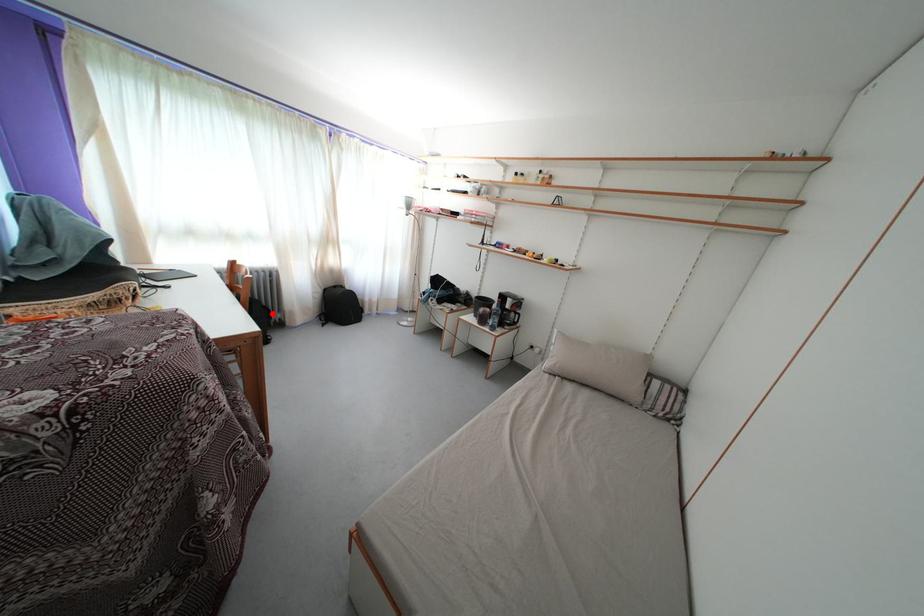
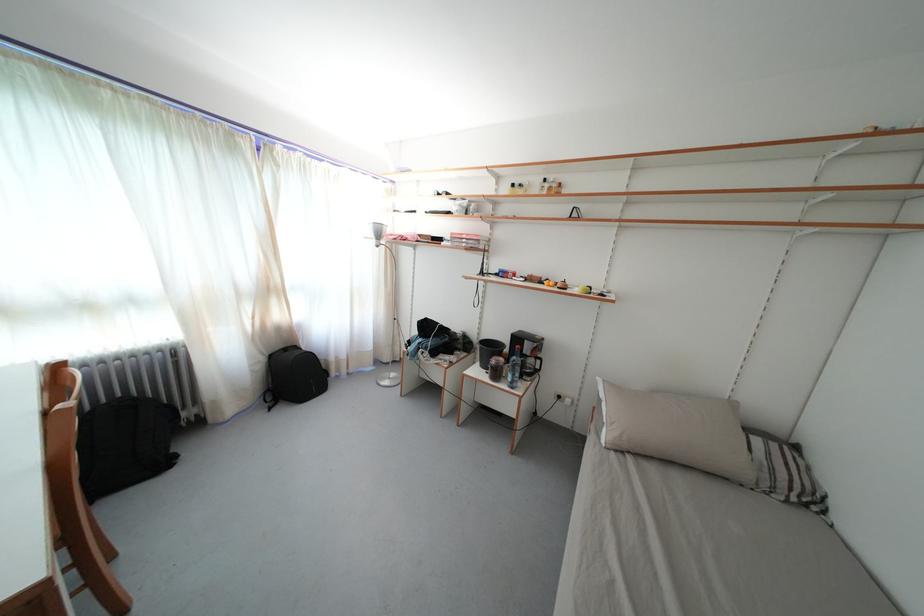
Find the pixel in the second image that matches the highlighted location in the first image.

(175, 411)